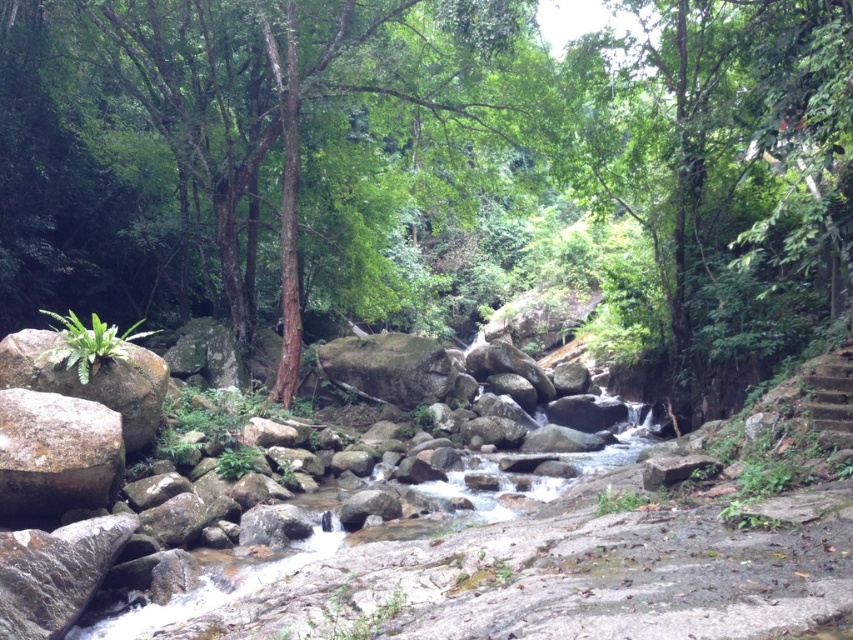
Question: Estimate the real-world distances between objects in this image. Which object is closer to the gray rough boulder at left?

Choices:
 (A) clear water at center
 (B) green leafy tree at center

Answer: (A)

Question: Can you confirm if green leafy tree at center is positioned above gray rough boulder at left?

Choices:
 (A) no
 (B) yes

Answer: (B)

Question: Can you confirm if green leafy tree at center is positioned above clear water at center?

Choices:
 (A) no
 (B) yes

Answer: (B)

Question: Does green leafy tree at center appear on the right side of gray rough boulder at left?

Choices:
 (A) yes
 (B) no

Answer: (A)

Question: Which of the following is the farthest from the observer?

Choices:
 (A) gray rough boulder at left
 (B) green leafy tree at center
 (C) clear water at center

Answer: (B)

Question: Which point appears farthest from the camera in this image?

Choices:
 (A) (164, 605)
 (B) (54, 490)

Answer: (B)